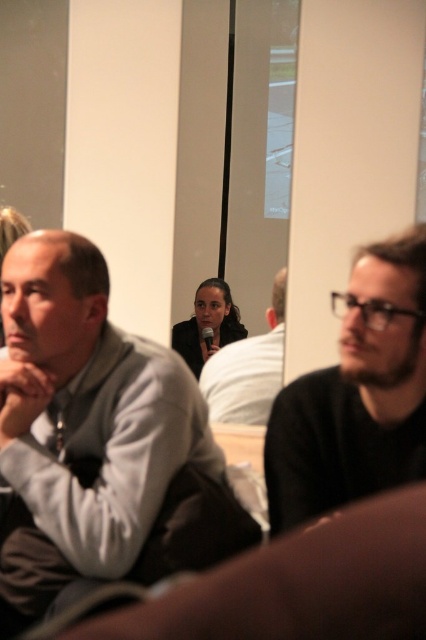
Question: Estimate the real-world distances between objects in this image. Which object is closer to the dark brown sweater at right?

Choices:
 (A) gray matte sweater at left
 (B) dark gray sweater at center

Answer: (A)

Question: Is gray matte sweater at left positioned in front of dark gray sweater at center?

Choices:
 (A) yes
 (B) no

Answer: (A)

Question: Observing the image, what is the correct spatial positioning of gray matte sweater at left in reference to dark gray sweater at center?

Choices:
 (A) above
 (B) below

Answer: (B)

Question: Can you confirm if gray matte sweater at left is smaller than dark brown sweater at right?

Choices:
 (A) yes
 (B) no

Answer: (B)

Question: Which point appears closest to the camera in this image?

Choices:
 (A) (23, 371)
 (B) (380, 310)

Answer: (B)

Question: Which object appears farthest from the camera in this image?

Choices:
 (A) gray matte sweater at left
 (B) dark gray sweater at center
 (C) dark brown sweater at right

Answer: (B)